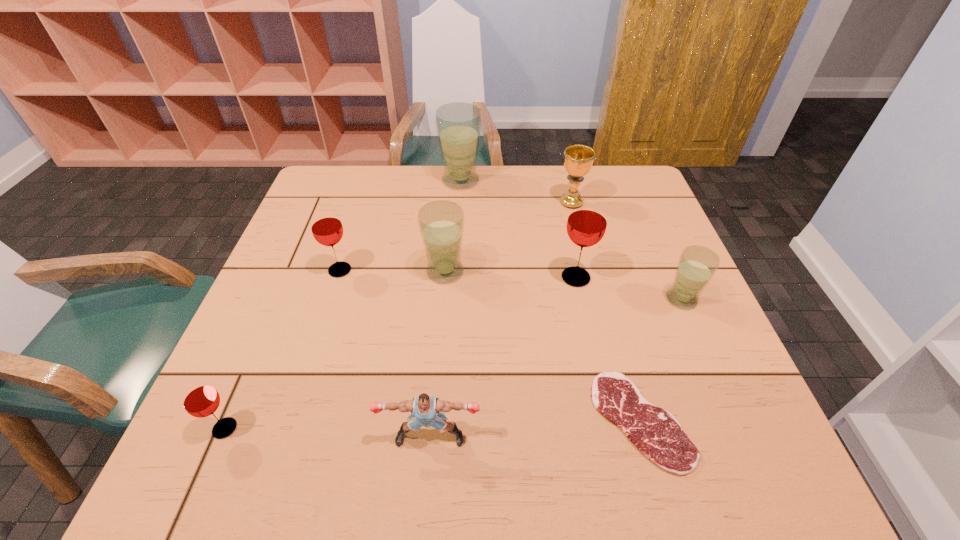
I want to click on the rightmost glass, so click(697, 265).

Find the location of a particular element. This screenshot has width=960, height=540. the rightmost blue glass is located at coordinates (697, 265).

Locate an element on the screen. the smallest red glass is located at coordinates (200, 399).

What are the coordinates of `the leftmost glass` in the screenshot? It's located at (200, 399).

I want to click on the shortest object, so click(654, 431).

Locate an element on the screen. Image resolution: width=960 pixels, height=540 pixels. red steak is located at coordinates (654, 431).

Locate an element on the screen. free space located on the back of the biggest red glass is located at coordinates (561, 207).

The height and width of the screenshot is (540, 960). What are the coordinates of `vacant position located 0.230m on the right of the farthest object` in the screenshot? It's located at tap(554, 180).

At what (x,y) coordinates should I click in order to perform the action: click on free space located 0.200m on the front of the eighth object from right to left. Please return your answer as a coordinate pair (x, y). The width and height of the screenshot is (960, 540). Looking at the image, I should click on (315, 347).

You are a GUI agent. You are given a task and a screenshot of the screen. Output one action in this format:
    pyautogui.click(x=<x>, y=<y>)
    Task: Click on the vacant region located on the left of the second biggest blue glass
    The width and height of the screenshot is (960, 540).
    Given the screenshot: What is the action you would take?
    pyautogui.click(x=308, y=272)